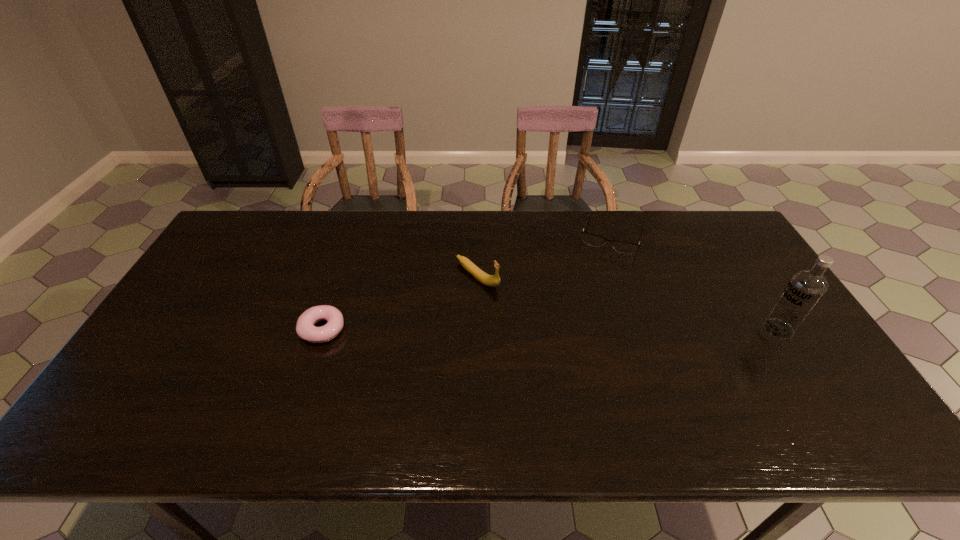
Locate an element on the screen. This screenshot has height=540, width=960. vacant space positioned 0.320m on the front label of the vodka is located at coordinates (646, 329).

Identify the location of free space located on the front-facing side of the farthest object. (602, 264).

At what (x,y) coordinates should I click in order to perform the action: click on vacant space located on the front-facing side of the farthest object. Please return your answer as a coordinate pair (x, y). The height and width of the screenshot is (540, 960). Looking at the image, I should click on (583, 323).

The width and height of the screenshot is (960, 540). I want to click on vacant space located on the front-facing side of the farthest object, so click(x=592, y=293).

Locate an element on the screen. This screenshot has height=540, width=960. vacant space located at the stem of the banana is located at coordinates (559, 340).

Where is `vacant region located 0.280m at the stem of the banana`? This screenshot has height=540, width=960. vacant region located 0.280m at the stem of the banana is located at coordinates (564, 344).

Locate an element on the screen. vacant region located 0.310m at the stem of the banana is located at coordinates (573, 350).

At what (x,y) coordinates should I click in order to perform the action: click on object that is at the far edge. Please return your answer as a coordinate pair (x, y). This screenshot has height=540, width=960. Looking at the image, I should click on (594, 240).

In order to click on object located at the right edge in this screenshot , I will do `click(805, 289)`.

At what (x,y) coordinates should I click in order to perform the action: click on free space at the far edge of the desktop. Please return your answer as a coordinate pair (x, y). Looking at the image, I should click on (472, 242).